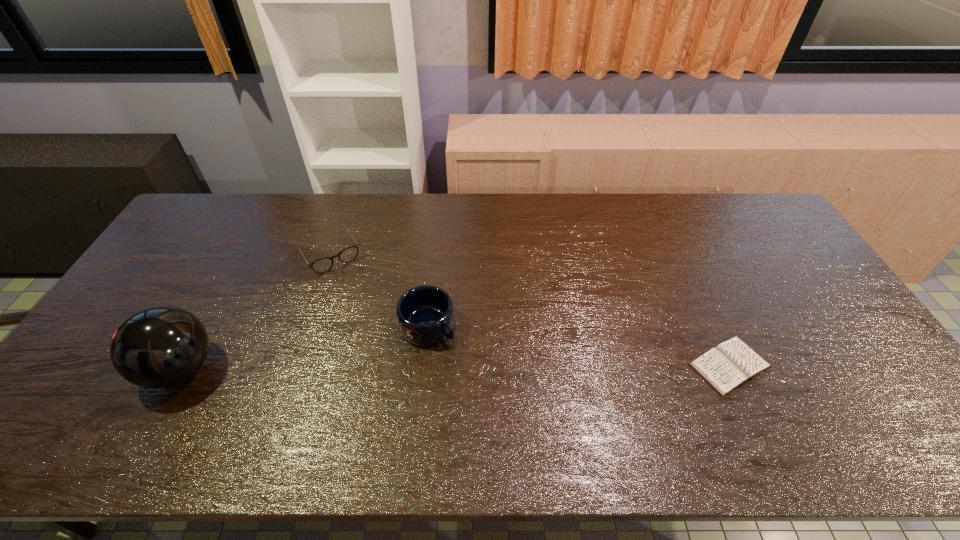
The height and width of the screenshot is (540, 960). Find the location of `free location at the far edge`. free location at the far edge is located at coordinates (684, 222).

This screenshot has width=960, height=540. Find the location of `vacant area at the near edge`. vacant area at the near edge is located at coordinates tap(423, 399).

In the image, there is a desktop. In order to click on free space at the right edge in this screenshot , I will do `click(841, 332)`.

This screenshot has width=960, height=540. Find the location of `unoccupied area between the third object from right to left and the mug`. unoccupied area between the third object from right to left and the mug is located at coordinates (378, 288).

This screenshot has width=960, height=540. What are the coordinates of `blank region between the farthest object and the rightmost object` in the screenshot? It's located at (529, 308).

Identify the location of vacant area that lies between the third object from left to right and the tallest object. Image resolution: width=960 pixels, height=540 pixels. (304, 347).

This screenshot has height=540, width=960. I want to click on free spot between the second object from right to left and the bowling ball, so click(304, 347).

You are a GUI agent. You are given a task and a screenshot of the screen. Output one action in this format:
    pyautogui.click(x=<x>, y=<y>)
    Task: Click on the empty location between the shortest object and the second object from left to right
    
    Given the screenshot: What is the action you would take?
    pyautogui.click(x=529, y=308)

Identify the location of blank region between the third tallest object and the shortest object. The image size is (960, 540). (529, 308).

Image resolution: width=960 pixels, height=540 pixels. I want to click on vacant space that is in between the bowling ball and the second object from right to left, so click(x=304, y=347).